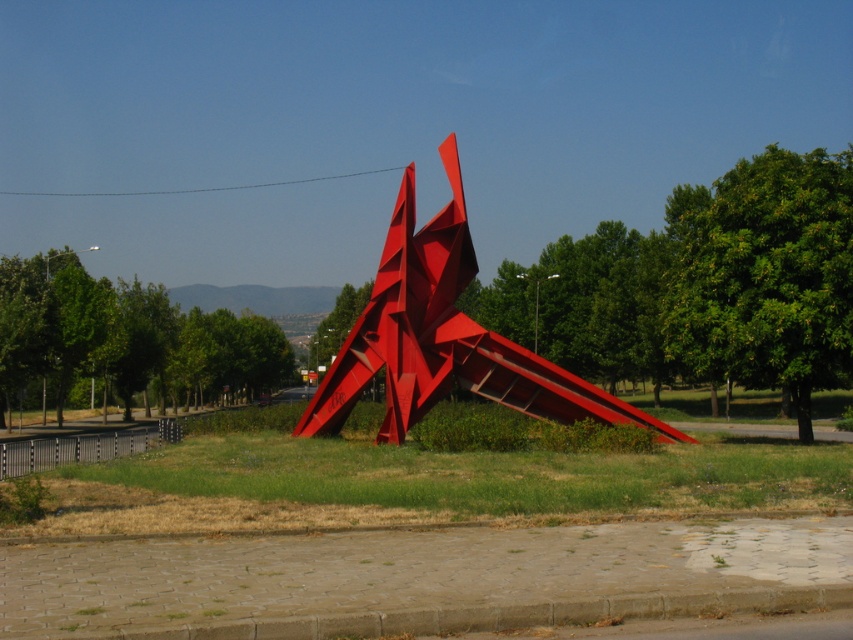
You are a gardener planning to mow the green grass at center and the glossy metal sculpture at center. Which object should you avoid mowing to prevent damage?

You should avoid mowing the glossy metal sculpture at center because it is an inanimate object and mowing it could cause damage to both the sculpture and the lawnmower.

Looking at this image, you are standing on the paved walkway and see the green leafy tree at center and the green leafy tree at left. Which tree is positioned to the right of the other?

The green leafy tree at center is positioned to the right of the green leafy tree at left.

You are a visitor walking along the paved walkway next to the grassy area. You want to take a photo of the glossy metal sculpture at center from the left side of the green leafy tree at left. Is the sculpture visible from that position?

The glossy metal sculpture at center is positioned on the right side of the green leafy tree at left, so it should be visible from the left side of the green leafy tree at left as they are positioned next to each other.